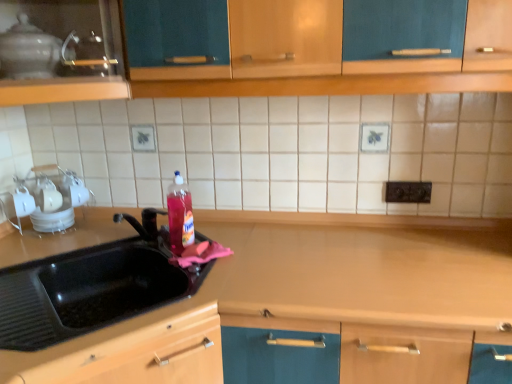
In order to click on vacant region in front of white glossy dish rack at left, positioned as the 2th appliance in front-to-back order in this screenshot , I will do `click(42, 246)`.